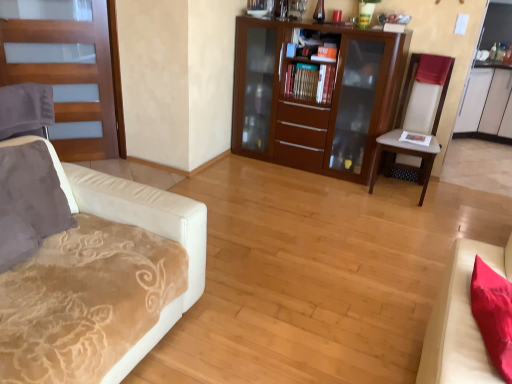
Question: Are beige fabric chair at right and hardcover books at center making contact?

Choices:
 (A) no
 (B) yes

Answer: (A)

Question: Does beige fabric chair at right have a lesser width compared to hardcover books at center?

Choices:
 (A) no
 (B) yes

Answer: (A)

Question: Does beige fabric chair at right have a lesser height compared to hardcover books at center?

Choices:
 (A) yes
 (B) no

Answer: (B)

Question: From the image's perspective, does beige fabric chair at right appear higher than hardcover books at center?

Choices:
 (A) yes
 (B) no

Answer: (B)

Question: Considering the relative sizes of beige fabric chair at right and hardcover books at center in the image provided, is beige fabric chair at right taller than hardcover books at center?

Choices:
 (A) yes
 (B) no

Answer: (A)

Question: Looking at their shapes, would you say hardcover books at center is wider or thinner than velvet beige couch at left, the 1th studio couch in the left-to-right sequence?

Choices:
 (A) thin
 (B) wide

Answer: (A)

Question: From the image's perspective, is hardcover books at center positioned above or below velvet beige couch at left, marked as the 2th studio couch in a right-to-left arrangement?

Choices:
 (A) above
 (B) below

Answer: (A)

Question: Do you think hardcover books at center is within velvet beige couch at left, the 1th studio couch in the left-to-right sequence, or outside of it?

Choices:
 (A) inside
 (B) outside

Answer: (B)

Question: Considering the relative positions of hardcover books at center and velvet beige couch at left, marked as the 2th studio couch in a right-to-left arrangement, in the image provided, is hardcover books at center to the left or to the right of velvet beige couch at left, marked as the 2th studio couch in a right-to-left arrangement,?

Choices:
 (A) left
 (B) right

Answer: (B)

Question: Is velvet beige studio couch at lower right, the 1th studio couch positioned from the right, in front of or behind hardcover books at center in the image?

Choices:
 (A) behind
 (B) front

Answer: (B)

Question: From the image's perspective, is velvet beige studio couch at lower right, the 1th studio couch positioned from the right, positioned above or below hardcover books at center?

Choices:
 (A) above
 (B) below

Answer: (B)

Question: Does point (485, 246) appear closer or farther from the camera than point (318, 69)?

Choices:
 (A) farther
 (B) closer

Answer: (B)

Question: In terms of size, does velvet beige studio couch at lower right, the 1th studio couch positioned from the right, appear bigger or smaller than hardcover books at center?

Choices:
 (A) small
 (B) big

Answer: (B)

Question: Considering their positions, is hardcover books at center located in front of or behind wooden door at left?

Choices:
 (A) front
 (B) behind

Answer: (B)

Question: In the image, is hardcover books at center on the left side or the right side of wooden door at left?

Choices:
 (A) right
 (B) left

Answer: (A)